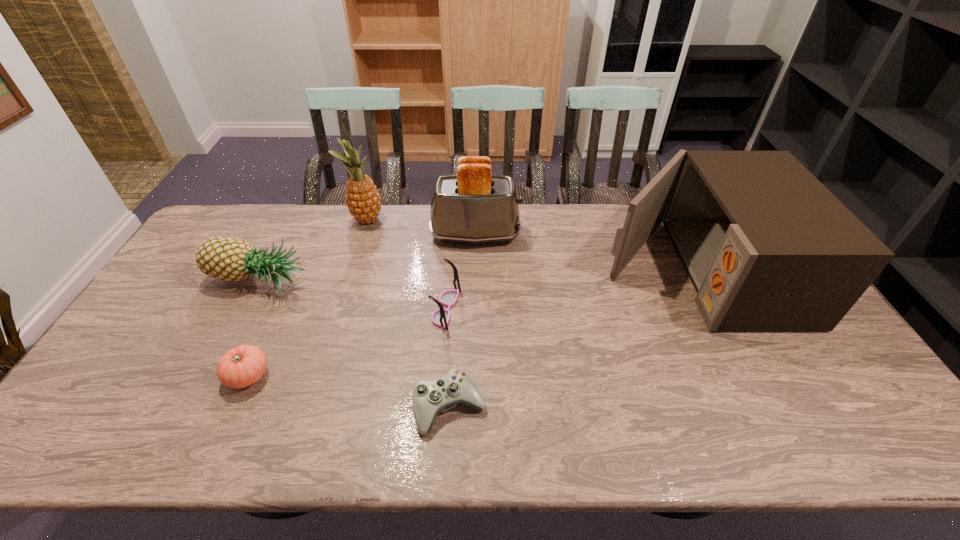
This screenshot has height=540, width=960. I want to click on vacant space that is in between the toaster and the tomato, so click(362, 306).

Identify the location of free space between the tomato and the control. (349, 392).

Identify the location of free space between the toaster and the taller pineapple. This screenshot has height=540, width=960. click(x=421, y=227).

The image size is (960, 540). I want to click on vacant point located between the second shortest object and the fourth tallest object, so click(x=253, y=330).

Find the location of a particular element. This screenshot has height=540, width=960. free area in between the spectacles and the shortest object is located at coordinates (448, 358).

Where is `vacant space that is in between the third object from left to right and the rightmost object`? Image resolution: width=960 pixels, height=540 pixels. vacant space that is in between the third object from left to right and the rightmost object is located at coordinates (530, 245).

Identify the location of vacant space that's between the toaster and the control. This screenshot has width=960, height=540. (463, 321).

Where is `free spot between the toaster and the right pineapple`? Image resolution: width=960 pixels, height=540 pixels. free spot between the toaster and the right pineapple is located at coordinates (421, 227).

This screenshot has height=540, width=960. I want to click on object that is the fourth closest to the tomato, so (363, 200).

The height and width of the screenshot is (540, 960). In order to click on the second closest object to the tomato in this screenshot , I will do `click(430, 398)`.